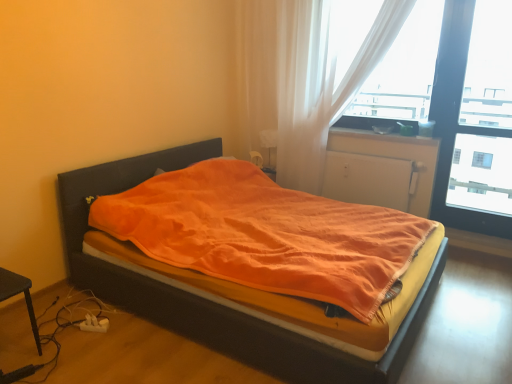
Question: Should I look upward or downward to see transparent glass window at upper right?

Choices:
 (A) down
 (B) up

Answer: (B)

Question: From the image's perspective, is white sheer curtain at upper right, the 2th curtain from the left, above transparent glass window at upper right?

Choices:
 (A) yes
 (B) no

Answer: (A)

Question: Considering the relative sizes of white sheer curtain at upper right, the 2th curtain from the left, and transparent glass window at upper right in the image provided, is white sheer curtain at upper right, the 2th curtain from the left, bigger than transparent glass window at upper right?

Choices:
 (A) no
 (B) yes

Answer: (A)

Question: Does white sheer curtain at upper right, the 1th curtain viewed from the right, have a smaller size compared to transparent glass window at upper right?

Choices:
 (A) no
 (B) yes

Answer: (B)

Question: Is white sheer curtain at upper right, the 1th curtain viewed from the right, to the left of transparent glass window at upper right from the viewer's perspective?

Choices:
 (A) yes
 (B) no

Answer: (A)

Question: Does white sheer curtain at upper right, the 2th curtain from the left, have a greater height compared to transparent glass window at upper right?

Choices:
 (A) yes
 (B) no

Answer: (B)

Question: Is white sheer curtain at upper right, the 1th curtain viewed from the right, in contact with transparent glass window at upper right?

Choices:
 (A) no
 (B) yes

Answer: (A)

Question: Is matte plastic window sill at upper right oriented away from transparent glass window at upper right?

Choices:
 (A) no
 (B) yes

Answer: (A)

Question: From the image's perspective, is matte plastic window sill at upper right above transparent glass window at upper right?

Choices:
 (A) no
 (B) yes

Answer: (A)

Question: Is matte plastic window sill at upper right behind transparent glass window at upper right?

Choices:
 (A) yes
 (B) no

Answer: (A)

Question: Is matte plastic window sill at upper right bigger than transparent glass window at upper right?

Choices:
 (A) yes
 (B) no

Answer: (B)

Question: Does matte plastic window sill at upper right touch transparent glass window at upper right?

Choices:
 (A) yes
 (B) no

Answer: (B)

Question: Is matte plastic window sill at upper right not inside transparent glass window at upper right?

Choices:
 (A) no
 (B) yes

Answer: (B)

Question: Does white plastic charger at lower left have a lesser height compared to white matte radiator at center?

Choices:
 (A) yes
 (B) no

Answer: (A)